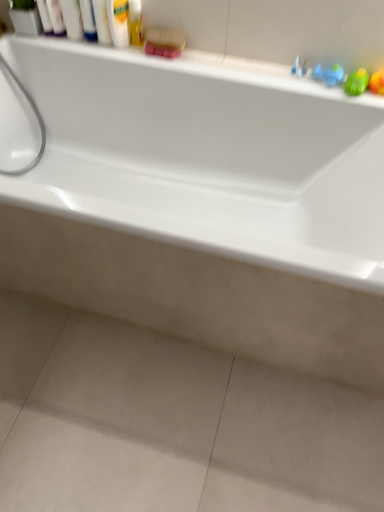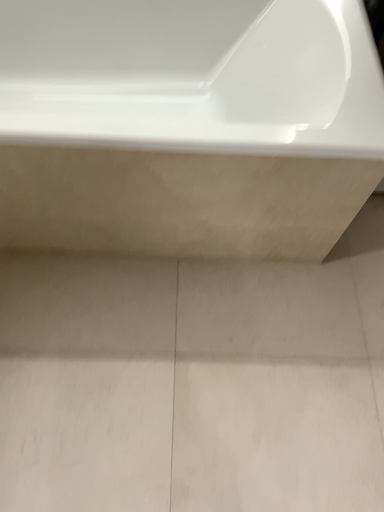
Question: How did the camera likely rotate when shooting the video?

Choices:
 (A) rotated downward
 (B) rotated upward

Answer: (A)